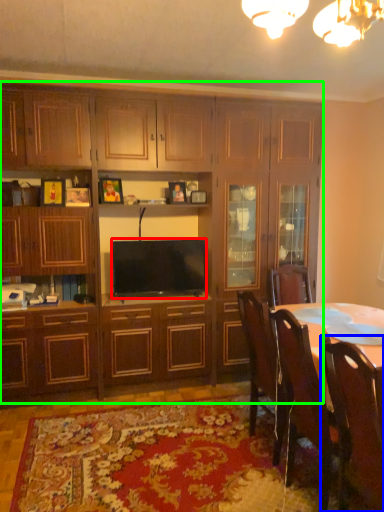
Question: Which is farther away from television (highlighted by a red box)? chair (highlighted by a blue box) or cabinetry (highlighted by a green box)?

Choices:
 (A) chair
 (B) cabinetry

Answer: (A)